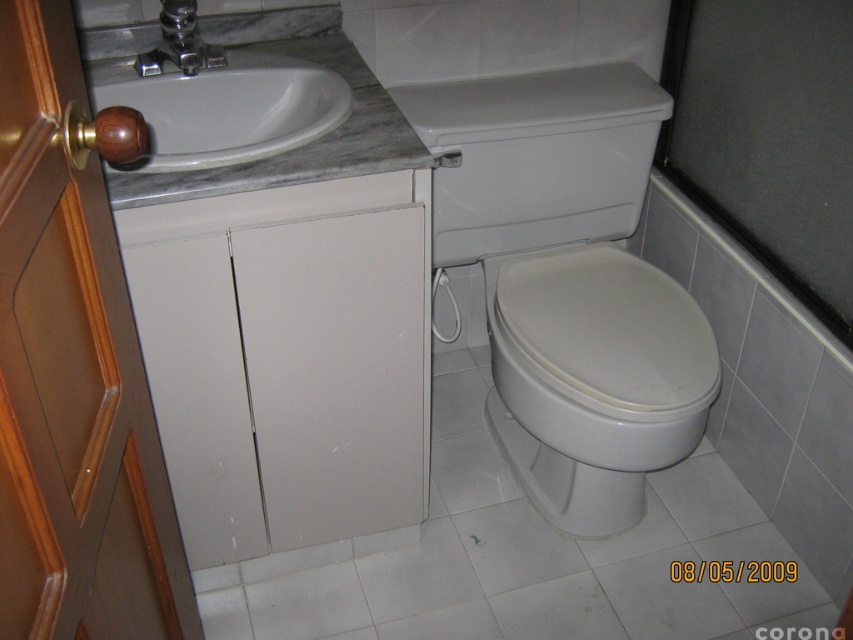
Question: Which of the following is the farthest from the observer?

Choices:
 (A) (166, 6)
 (B) (165, 1)
 (C) (537, 445)
 (D) (672, 288)

Answer: (C)

Question: Is the position of white glossy toilet at center more distant than that of silver metallic faucet at upper center?

Choices:
 (A) yes
 (B) no

Answer: (A)

Question: Does white glossy toilet at right appear under white glossy toilet at center?

Choices:
 (A) yes
 (B) no

Answer: (B)

Question: Which object is farther from the camera taking this photo?

Choices:
 (A) white glossy toilet at center
 (B) silver metallic faucet at upper center
 (C) white glossy toilet at right
 (D) white glossy sink at upper left

Answer: (C)

Question: Does white glossy toilet at center have a greater width compared to silver metallic faucet at upper center?

Choices:
 (A) yes
 (B) no

Answer: (A)

Question: Which point is closer to the camera?

Choices:
 (A) white glossy sink at upper left
 (B) white glossy toilet at center
 (C) silver metallic faucet at upper center
 (D) white glossy toilet at right

Answer: (A)